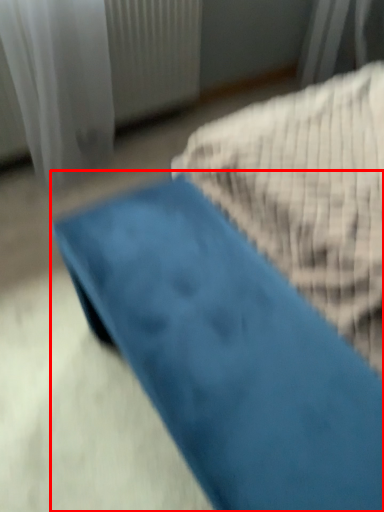
Question: Observing the image, what is the correct spatial positioning of furniture (annotated by the red box) in reference to curtain?

Choices:
 (A) right
 (B) left

Answer: (A)